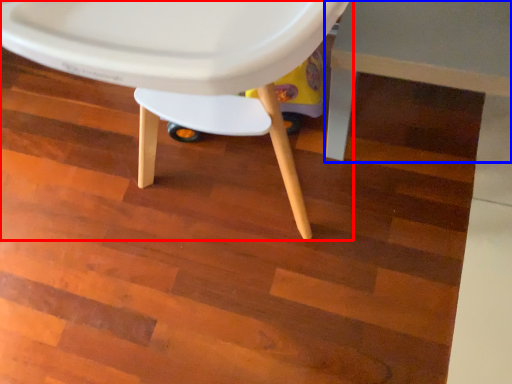
Question: Which object appears closest to the camera in this image, chair (highlighted by a red box) or table (highlighted by a blue box)?

Choices:
 (A) chair
 (B) table

Answer: (A)